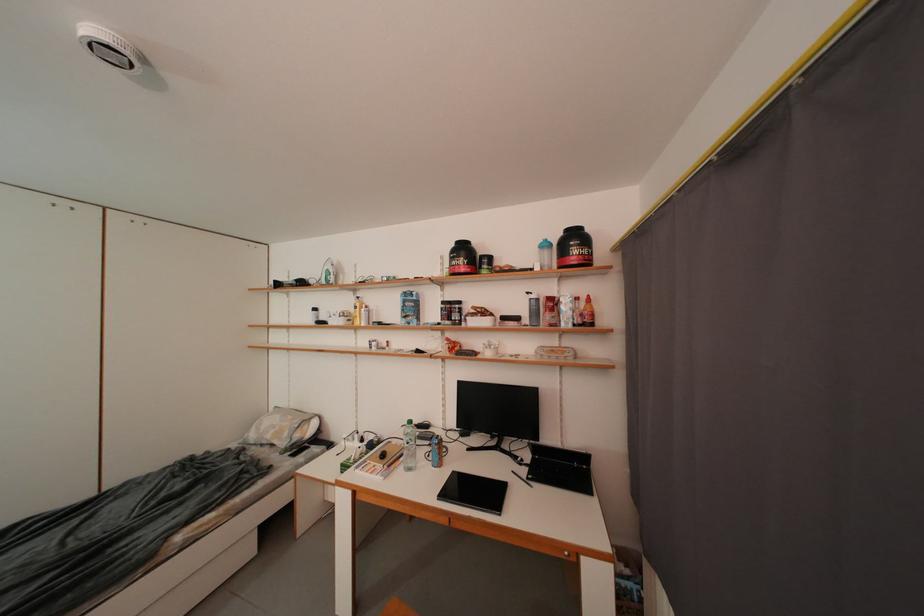
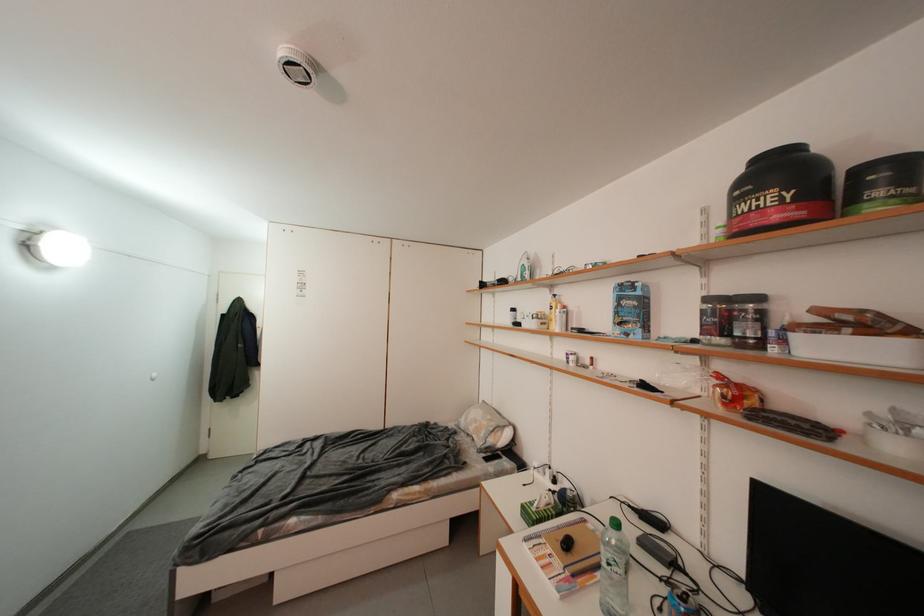
Locate, in the second image, the point that corresponds to [411,305] in the first image.

(627, 302)